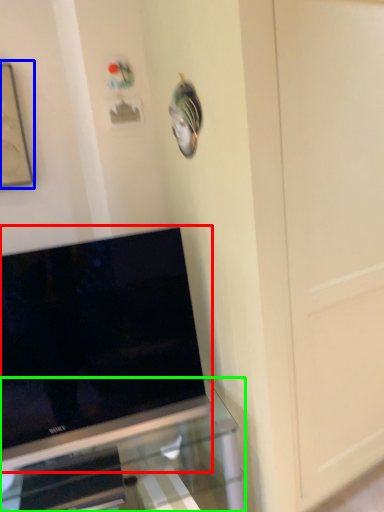
Question: Based on their relative distances, which object is farther from television (highlighted by a red box)? Choose from picture frame (highlighted by a blue box) and furniture (highlighted by a green box).

Choices:
 (A) picture frame
 (B) furniture

Answer: (A)